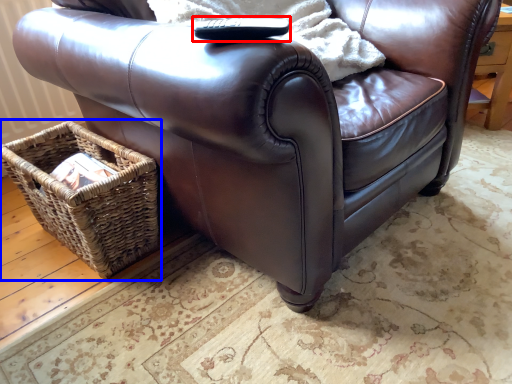
Question: Among these objects, which one is nearest to the camera, remote (highlighted by a red box) or picnic basket (highlighted by a blue box)?

Choices:
 (A) remote
 (B) picnic basket

Answer: (A)